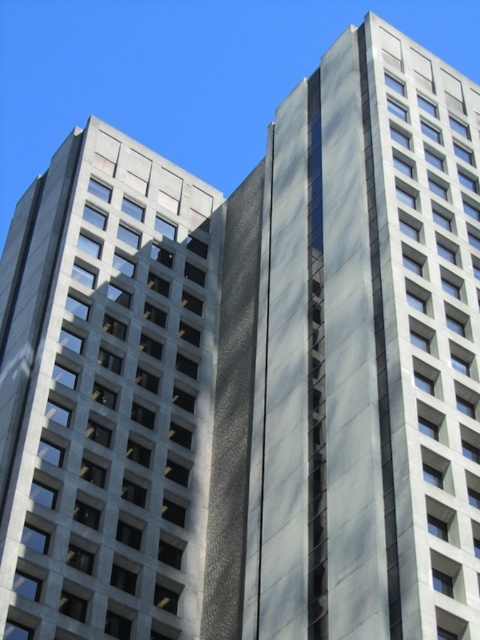
Which of these two, gray concrete building at center or gray concrete building at left, stands shorter?

With less height is gray concrete building at left.

Is point (273, 627) more distant than point (15, 404)?

That is False.

This screenshot has height=640, width=480. I want to click on gray concrete building at center, so click(368, 353).